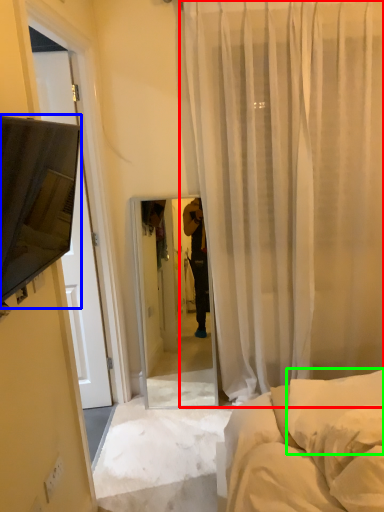
Question: Which object is positioned farthest from curtain (highlighted by a red box)? Select from canopy bed (highlighted by a blue box) and pillow (highlighted by a green box).

Choices:
 (A) canopy bed
 (B) pillow

Answer: (A)